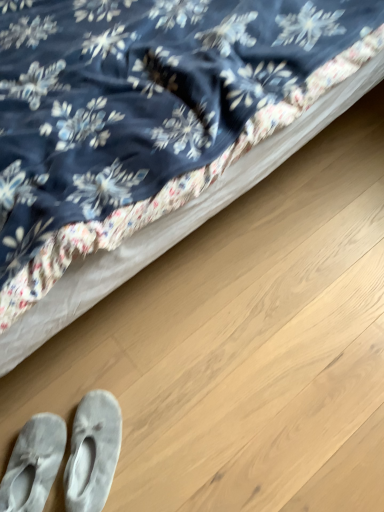
The width and height of the screenshot is (384, 512). I want to click on vacant area situated below gray suede slippers at lower left, the 2th footwear viewed from the right (from a real-world perspective), so click(35, 477).